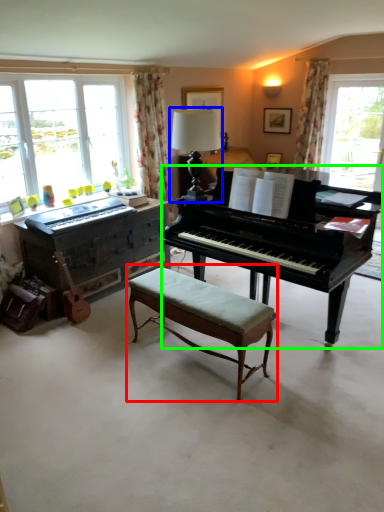
Question: Which object is the farthest from table (highlighted by a red box)? Choose among these: table lamp (highlighted by a blue box) or piano (highlighted by a green box).

Choices:
 (A) table lamp
 (B) piano

Answer: (A)